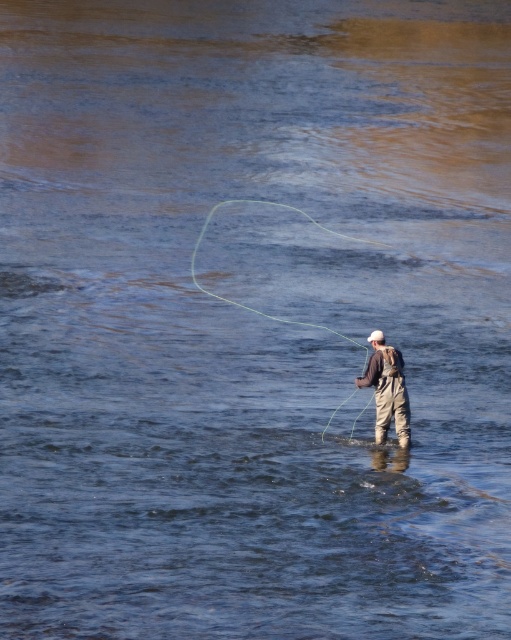
Question: Among these objects, which one is farthest from the camera?

Choices:
 (A) green rubber string at center
 (B) khaki waterproof waders at center

Answer: (A)

Question: Is khaki waterproof waders at center to the right of green rubber string at center from the viewer's perspective?

Choices:
 (A) no
 (B) yes

Answer: (B)

Question: Can you confirm if khaki waterproof waders at center is positioned to the left of green rubber string at center?

Choices:
 (A) yes
 (B) no

Answer: (B)

Question: Is khaki waterproof waders at center smaller than green rubber string at center?

Choices:
 (A) no
 (B) yes

Answer: (B)

Question: Which point is farther to the camera?

Choices:
 (A) green rubber string at center
 (B) khaki waterproof waders at center

Answer: (A)